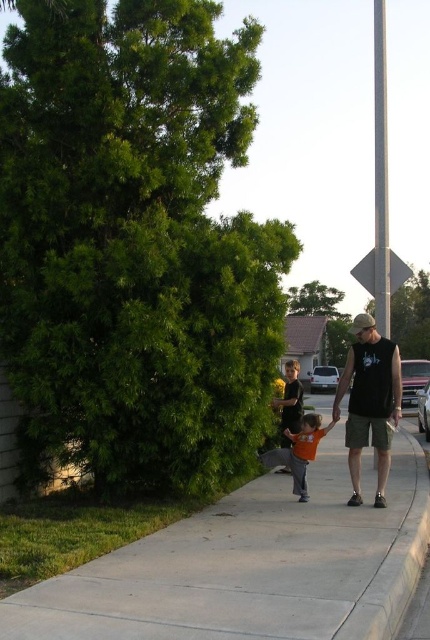
Question: Which object is closer to the camera taking this photo?

Choices:
 (A) orange cotton shirt at center
 (B) concrete sidewalk at center
 (C) metallic silver pole at upper center
 (D) black sleeveless shirt at center

Answer: (B)

Question: Is black sleeveless shirt at center below metallic silver pole at upper center?

Choices:
 (A) no
 (B) yes

Answer: (B)

Question: Among these objects, which one is farthest from the camera?

Choices:
 (A) black matte diamond at upper right
 (B) concrete sidewalk at center
 (C) metallic silver pole at upper center

Answer: (A)

Question: Is metallic silver pole at upper center thinner than black matte diamond at upper right?

Choices:
 (A) no
 (B) yes

Answer: (A)

Question: Among these objects, which one is nearest to the camera?

Choices:
 (A) black sleeveless shirt at center
 (B) metallic silver pole at upper center

Answer: (A)

Question: Can you confirm if orange cotton shirt at center is positioned to the right of black matte diamond at upper right?

Choices:
 (A) yes
 (B) no

Answer: (B)